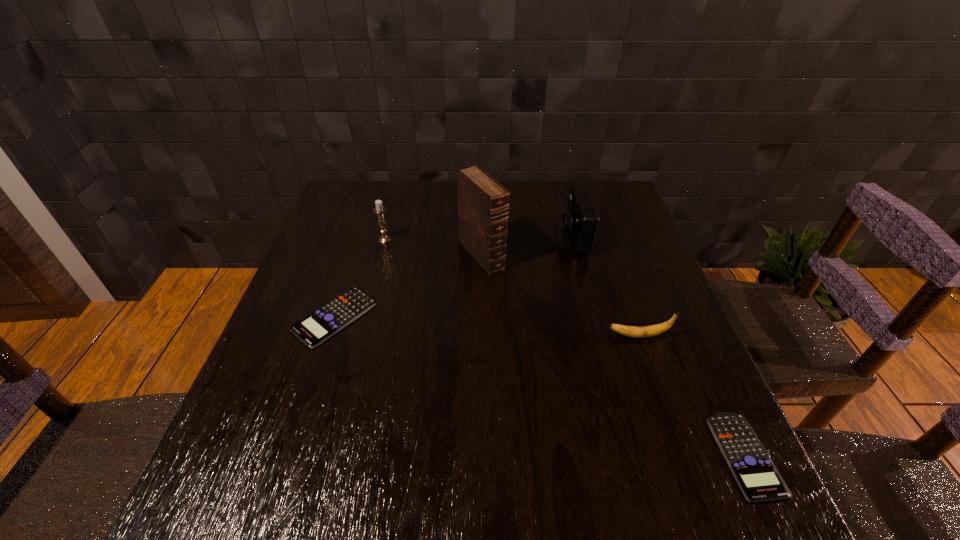
Find the location of a particular element. the farther calculator is located at coordinates pos(314,329).

Where is `the left calculator`? Image resolution: width=960 pixels, height=540 pixels. the left calculator is located at coordinates (314, 329).

Identify the location of the rightmost object. The height and width of the screenshot is (540, 960). (759, 480).

The height and width of the screenshot is (540, 960). Find the location of `the shortest object`. the shortest object is located at coordinates (759, 480).

This screenshot has width=960, height=540. Find the location of `camera`. camera is located at coordinates (581, 220).

I want to click on candle holder, so click(379, 209).

Find the location of a particular element. the tallest object is located at coordinates (483, 203).

At what (x,y) coordinates should I click in order to perform the action: click on the fourth object from right to left. Please return your answer as a coordinate pair (x, y). This screenshot has height=540, width=960. Looking at the image, I should click on (483, 203).

Locate an element on the screen. The image size is (960, 540). banana is located at coordinates (653, 330).

Image resolution: width=960 pixels, height=540 pixels. I want to click on vacant space located on the front of the farther calculator, so click(x=301, y=417).